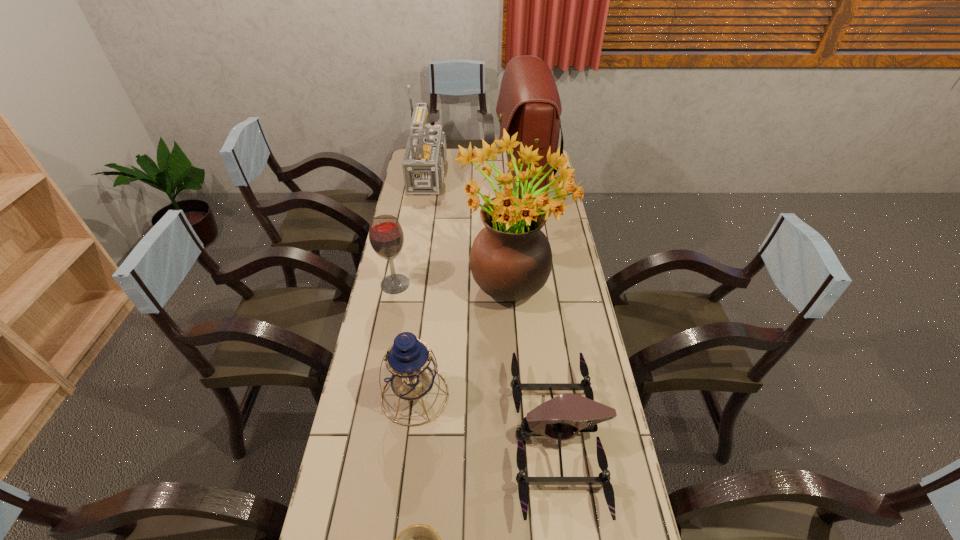
Where is `lantern located at the left edge`? The width and height of the screenshot is (960, 540). lantern located at the left edge is located at coordinates (410, 368).

The height and width of the screenshot is (540, 960). I want to click on satchel located in the right edge section of the desktop, so click(x=528, y=103).

The image size is (960, 540). Identify the location of flower arrangement that is at the right edge. (511, 259).

The height and width of the screenshot is (540, 960). I want to click on drone that is at the right edge, so click(558, 418).

Find the location of a particular element. This screenshot has width=960, height=540. object located at the far left corner is located at coordinates (423, 164).

Image resolution: width=960 pixels, height=540 pixels. Identify the location of object that is at the far right corner. (528, 103).

In the image, there is a desktop. Identify the location of vacant space at the left edge. (372, 489).

Find the location of a particular element. The image size is (960, 540). vacant space at the right edge is located at coordinates coord(553,312).

This screenshot has height=540, width=960. In order to click on free area in between the drone and the alcohol in this screenshot , I will do `click(477, 361)`.

This screenshot has width=960, height=540. Find the location of `the third closest object to the sixth tallest object`. the third closest object to the sixth tallest object is located at coordinates (410, 368).